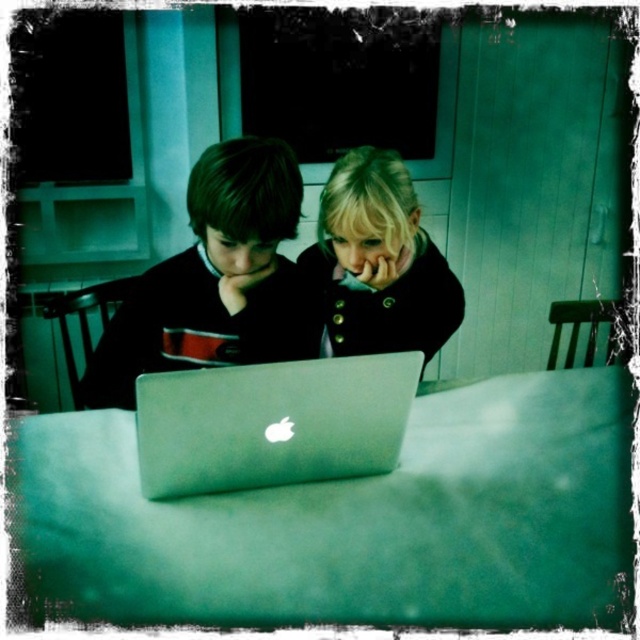
The scene shows two children focused on a laptop. Wait, but there are two laptops mentioned here. Let me check the objects again. Oh, the objects list says metallic silver laptop at center and silver metallic laptop at center. Hmm, maybe it was a typo? But the description says the metallic silver laptop is to the right of the silver metallic one. So the question should ask about their positions. Since the user might be confused by the similar names, the question can ask which laptop is on the right. The key

The metallic silver laptop at center is positioned to the right of the silver metallic laptop at center, so the metallic silver laptop at center is on the right side.

Based on the photo, you are a delivery person who needs to place a rectangular box that is 40 centimeters long between the silver metallic laptop at center and the matte black coat at center. Can you fit the box between them without moving either object?

The silver metallic laptop at center is 37.04 centimeters away from the matte black coat at center. The box is 40 centimeters long, which is slightly longer than the distance between the two objects. Therefore, the box cannot be placed between them without moving either object.